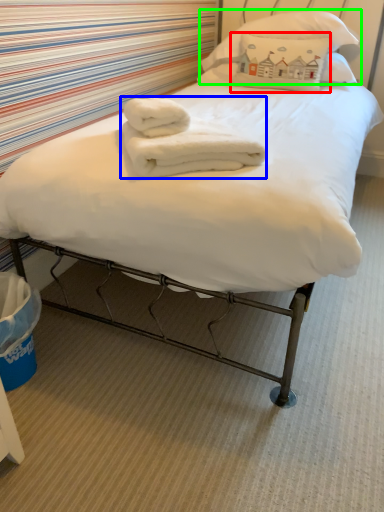
Question: Considering the real-world distances, which object is closest to pillow (highlighted by a red box)? bath towel (highlighted by a blue box) or pillow (highlighted by a green box).

Choices:
 (A) bath towel
 (B) pillow

Answer: (B)